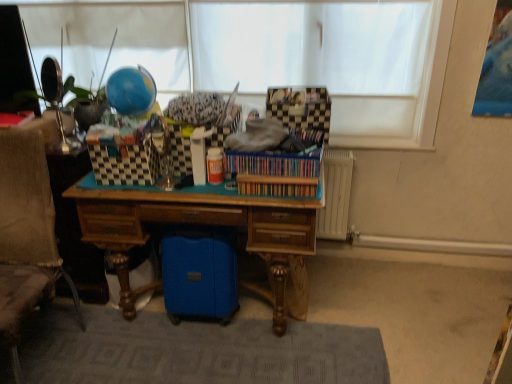
Question: Based on their sizes in the image, would you say wooden bookshelf at center, which appears as the second book when viewed from the top, is bigger or smaller than checkerboard-patterned fabric at upper center?

Choices:
 (A) big
 (B) small

Answer: (B)

Question: Is wooden bookshelf at center, which appears as the second book when viewed from the top, in front of or behind checkerboard-patterned fabric at upper center in the image?

Choices:
 (A) behind
 (B) front

Answer: (B)

Question: Based on their relative distances, which object is nearer to the textured beige fabric swivel chair at left?

Choices:
 (A) white sheer fabric at upper center
 (B) wooden bookshelf at center, which appears as the second book when viewed from the top
 (C) wooden desk at center
 (D) checkerboard-patterned fabric at upper center
 (E) gray textured rug at lower center

Answer: (C)

Question: Considering the real-world distances, which object is farthest from the white sheer fabric at upper center?

Choices:
 (A) wooden bookshelf at center, which appears as the second book when viewed from the top
 (B) checkerboard-patterned fabric at upper center
 (C) wooden desk at center
 (D) multicolored cardboard box at center, which appears as the 2th book when ordered from the bottom
 (E) textured beige fabric swivel chair at left

Answer: (E)